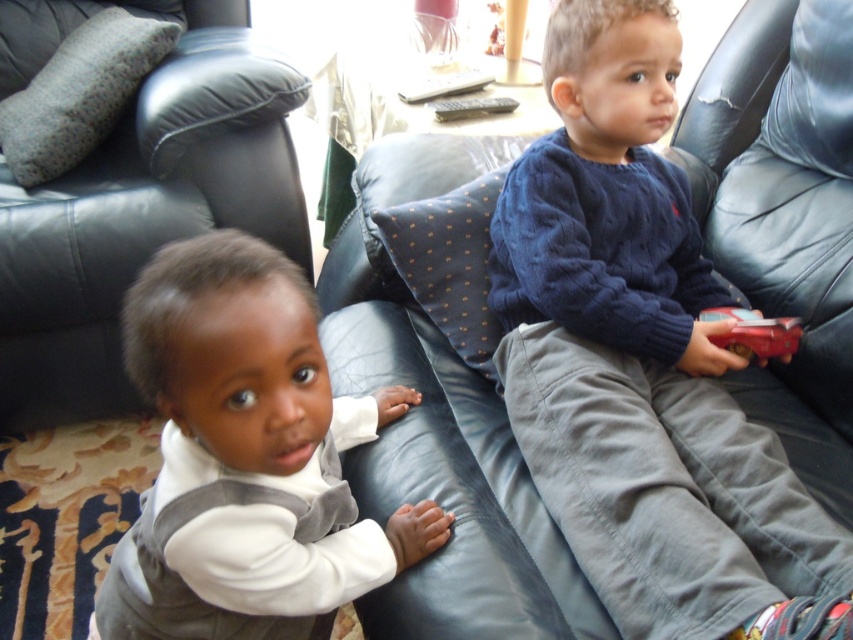
You are a delivery robot that needs to place a package between the white soft vest at lower left and the red plastic car at right. The package is 24 inches long. Can you fit the package between them without moving either object?

The distance between the white soft vest at lower left and the red plastic car at right is 25.95 inches. Since the package is 24 inches long, it can fit between them as there is enough space.

You are a photographer setting up for a family portrait. You need to ensure that the white soft vest at lower left and the black plastic remote at center are visible in the shot. Based on their positions, which object should you prioritize framing closer to the left side of the photo?

The white soft vest at lower left is positioned on the left side of the black plastic remote at center, so you should prioritize framing the white soft vest at lower left closer to the left side of the photo.